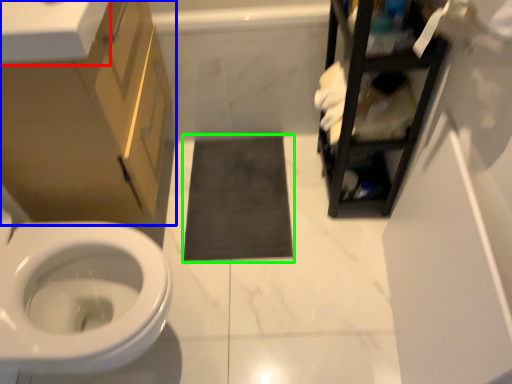
Question: Considering the real-world distances, which object is closest to counter top (highlighted by a red box)? bathroom cabinet (highlighted by a blue box) or bath mat (highlighted by a green box).

Choices:
 (A) bathroom cabinet
 (B) bath mat

Answer: (A)